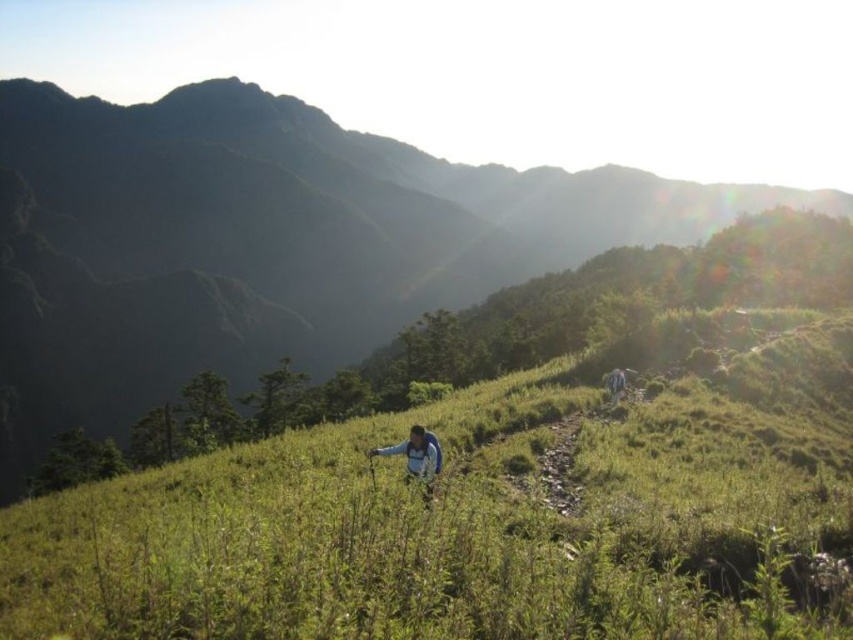
Looking at this image, does green grassy at center lie in front of green grassy hillside at center?

Yes, it is in front of green grassy hillside at center.

Find the location of a particular element. Image resolution: width=853 pixels, height=640 pixels. green grassy at center is located at coordinates (479, 520).

Is green grassy hillside at center wider than blue fleece jacket at center?

Correct, the width of green grassy hillside at center exceeds that of blue fleece jacket at center.

Which is in front, point (292, 180) or point (415, 472)?

Point (415, 472) is more forward.

This screenshot has height=640, width=853. I want to click on green grassy hillside at center, so click(265, 243).

Locate an element on the screen. The height and width of the screenshot is (640, 853). green grassy at center is located at coordinates (479, 520).

Does green grassy at center come behind blue fabric jacket at upper right?

No, green grassy at center is closer to the viewer.

Is point (248, 499) farther from viewer compared to point (614, 378)?

No, (248, 499) is closer to viewer.

You are a GUI agent. You are given a task and a screenshot of the screen. Output one action in this format:
    pyautogui.click(x=<x>, y=<y>)
    Task: Click on the green grassy at center
    
    Given the screenshot: What is the action you would take?
    pyautogui.click(x=479, y=520)